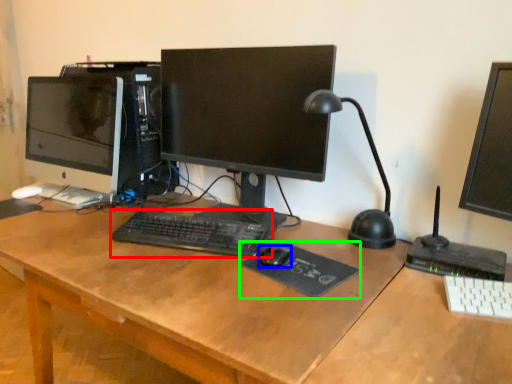
Question: Which object is positioned closest to computer keyboard (highlighted by a red box)? Select from mouse (highlighted by a blue box) and mousepad (highlighted by a green box).

Choices:
 (A) mouse
 (B) mousepad

Answer: (B)